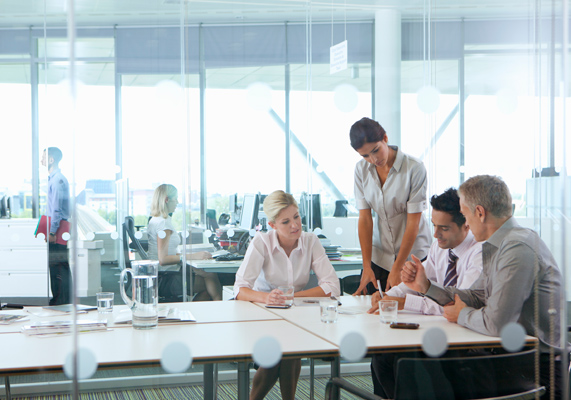
This screenshot has height=400, width=571. I want to click on window panes, so click(18, 113), click(75, 119), click(143, 126), click(242, 136), click(320, 120), click(412, 124), click(506, 132), click(545, 128).